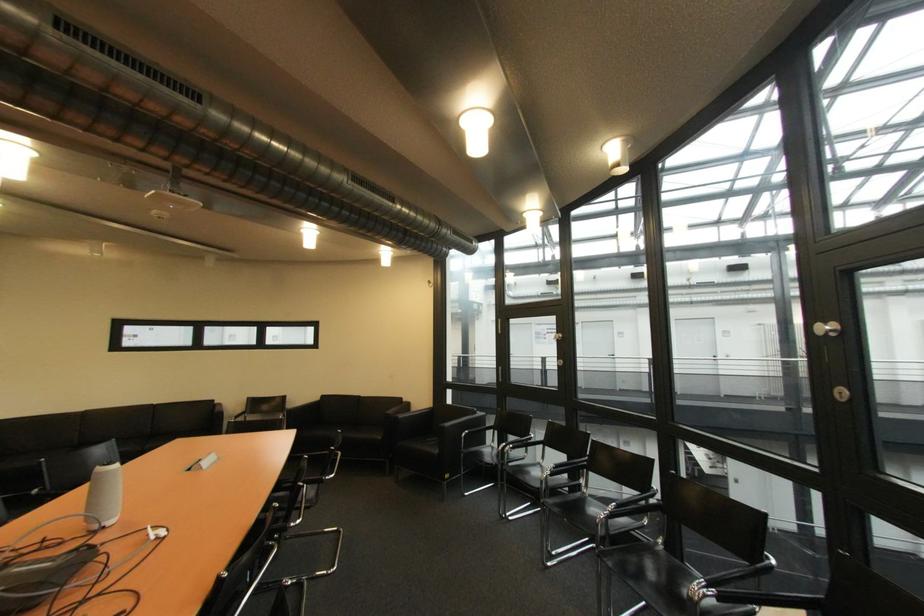
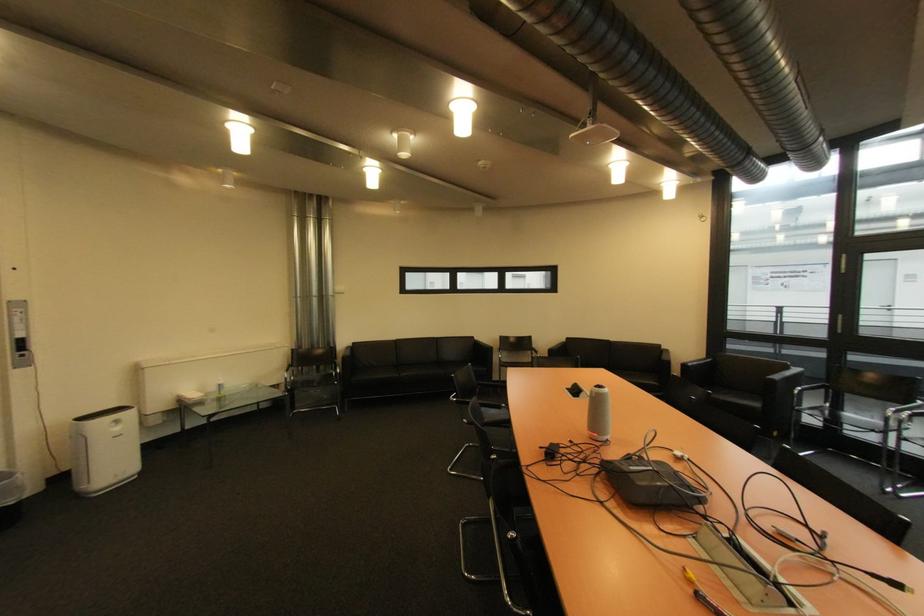
Question: The images are taken continuously from a first-person perspective. In which direction are you moving?

Choices:
 (A) Left
 (B) Right
 (C) Forward
 (D) Backward

Answer: (A)